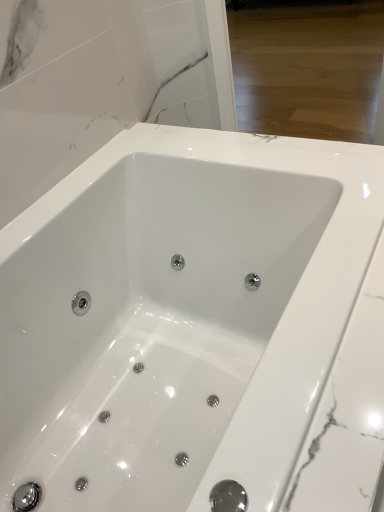
What do you see at coordinates (308, 69) in the screenshot? The image size is (384, 512). I see `wooden floor at upper right` at bounding box center [308, 69].

Locate an element on the screen. wooden floor at upper right is located at coordinates (308, 69).

Locate an element on the screen. The height and width of the screenshot is (512, 384). wooden floor at upper right is located at coordinates (308, 69).